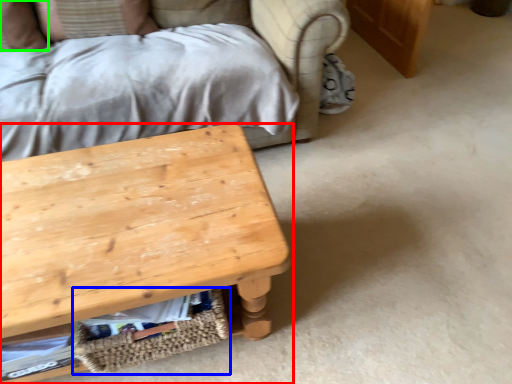
Question: Which object is positioned farthest from table (highlighted by a red box)? Select from basket (highlighted by a blue box) and pillow (highlighted by a green box).

Choices:
 (A) basket
 (B) pillow

Answer: (B)